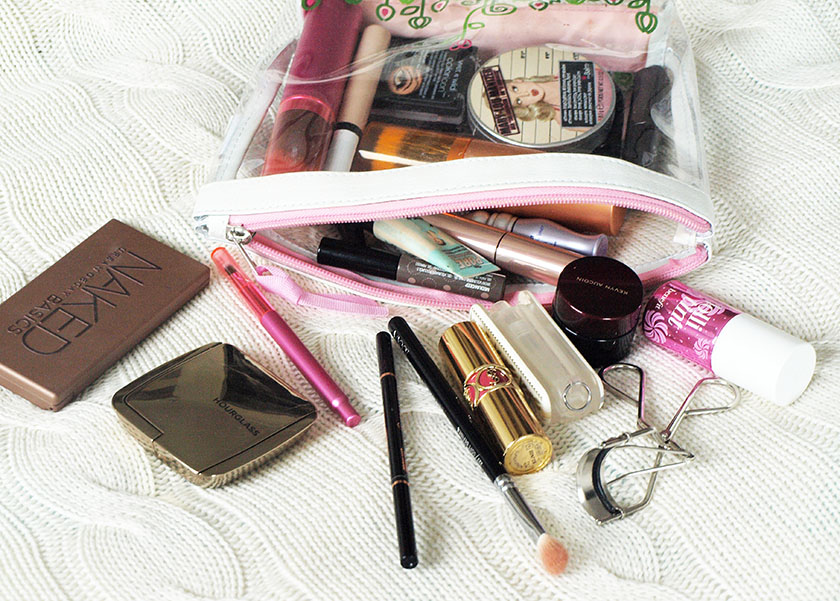
This screenshot has width=840, height=601. I want to click on knitted blanket, so click(809, 183).